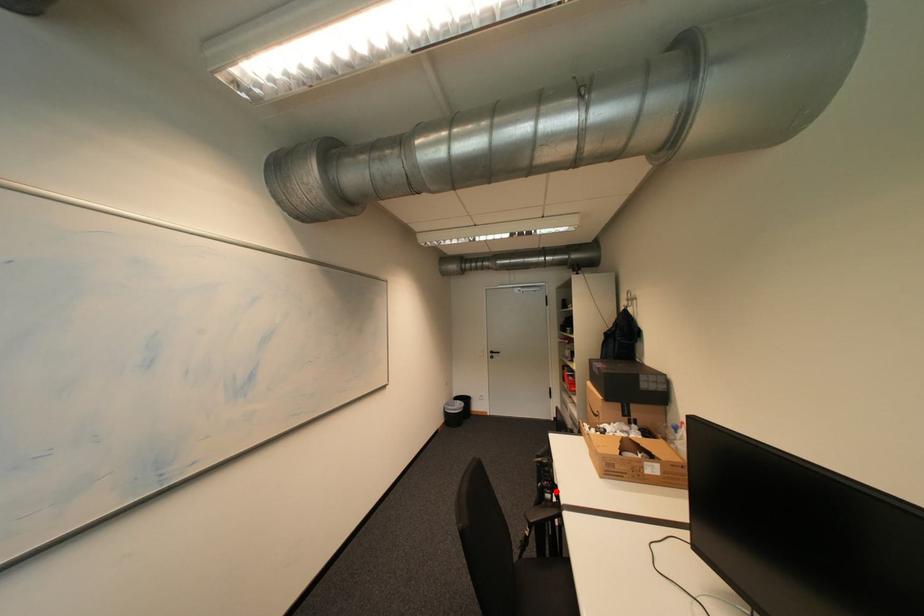
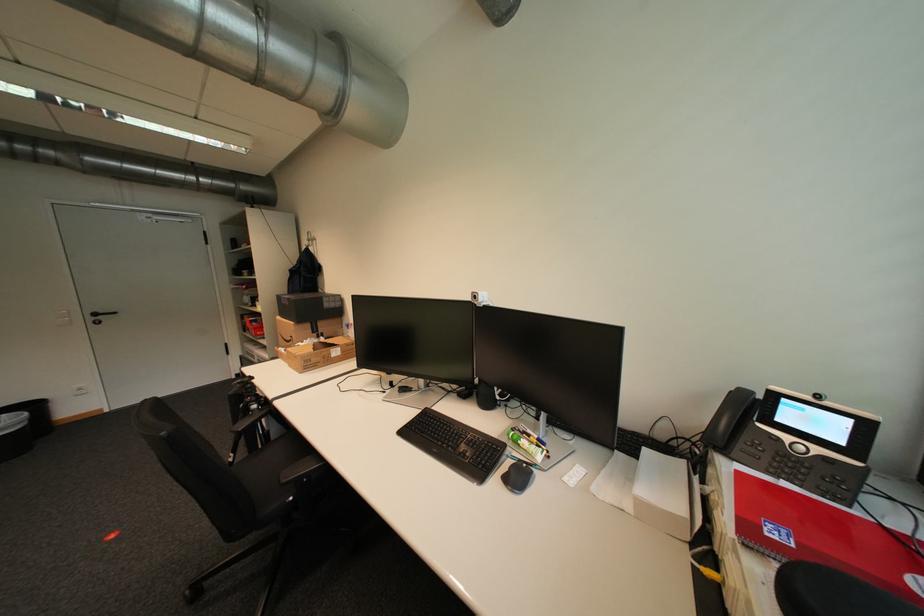
Where in the second image is the point corresponding to the highlighted location from the first image?

(261, 403)